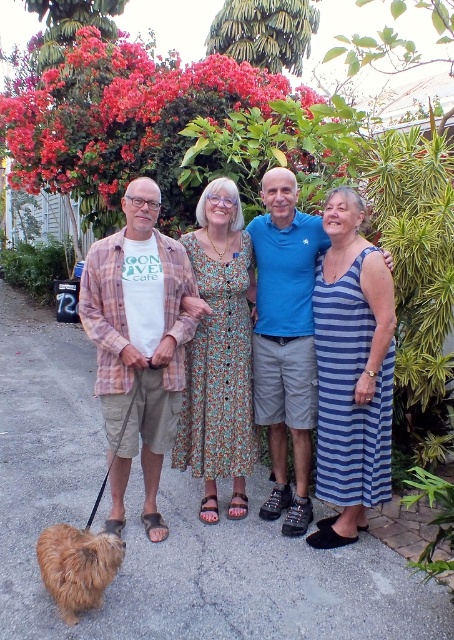
Which is in front, point (158, 310) or point (108, 548)?

Point (108, 548)

Does point (241, 484) lie behind point (70, 602)?

Yes, point (241, 484) is behind point (70, 602).

Is point (148, 520) closer to viewer compared to point (57, 582)?

No, (148, 520) is behind (57, 582).

Where is `matte cotton shirt at left`? matte cotton shirt at left is located at coordinates (133, 330).